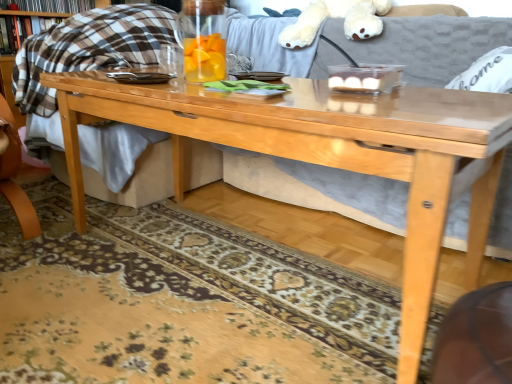
Measure the distance between point (193, 17) and camera.

The depth of point (193, 17) is 3.78 feet.

What is the approximate width of plaid fabric book at upper left, the second book from the top?

plaid fabric book at upper left, the second book from the top, is 14.29 centimeters in width.

Find the location of `white plush bear at upper center`. white plush bear at upper center is located at coordinates (336, 16).

This screenshot has width=512, height=384. I want to click on book that appears above the white plush bear at upper center (from a real-world perspective), so click(54, 5).

Is white plush bear at upper center aimed at hardcover book at upper left, which ranks as the 2th book in bottom-to-top order?

No, white plush bear at upper center is not turned towards hardcover book at upper left, which ranks as the 2th book in bottom-to-top order.

Consider the image. Does white plush bear at upper center lie behind hardcover book at upper left, marked as the first book in a top-to-bottom arrangement?

No, the depth of white plush bear at upper center is less than that of hardcover book at upper left, marked as the first book in a top-to-bottom arrangement.

Can you tell me how much white plush bear at upper center and hardcover book at upper left, which ranks as the 2th book in bottom-to-top order, differ in facing direction?

The facing directions of white plush bear at upper center and hardcover book at upper left, which ranks as the 2th book in bottom-to-top order, are 92.1 degrees apart.

Would you say white fabric pillow at upper right is part of white plush bear at upper center's contents?

No, white plush bear at upper center does not contain white fabric pillow at upper right.

Is white plush bear at upper center touching white fabric pillow at upper right?

white plush bear at upper center and white fabric pillow at upper right are clearly separated.

Is white plush bear at upper center facing away from white fabric pillow at upper right?

No, white plush bear at upper center's orientation is not away from white fabric pillow at upper right.

How different are the orientations of white plush bear at upper center and white fabric pillow at upper right in degrees?

white plush bear at upper center and white fabric pillow at upper right are facing 0.307 degrees away from each other.

Considering the sizes of objects plaid fabric book at upper left, the second book from the top, and transparent glass pitcher at center in the image provided, who is wider, plaid fabric book at upper left, the second book from the top, or transparent glass pitcher at center?

Wider between the two is transparent glass pitcher at center.

From the image's perspective, who appears lower, plaid fabric book at upper left, marked as the 1th book in a bottom-to-top arrangement, or transparent glass pitcher at center?

From the image's view, transparent glass pitcher at center is below.

Does plaid fabric book at upper left, marked as the 1th book in a bottom-to-top arrangement, have a larger size compared to transparent glass pitcher at center?

Correct, plaid fabric book at upper left, marked as the 1th book in a bottom-to-top arrangement, is larger in size than transparent glass pitcher at center.

Is hardcover book at upper left, which ranks as the 2th book in bottom-to-top order, not close to white plush bear at upper center?

Yes, hardcover book at upper left, which ranks as the 2th book in bottom-to-top order, and white plush bear at upper center are quite far apart.

Starting from the white plush bear at upper center, which book is the 1st one to the left? Please provide its 2D coordinates.

[(54, 5)]

Can you confirm if hardcover book at upper left, which ranks as the 2th book in bottom-to-top order, is thinner than white plush bear at upper center?

Correct, the width of hardcover book at upper left, which ranks as the 2th book in bottom-to-top order, is less than that of white plush bear at upper center.

Which object is closer to the camera, hardcover book at upper left, marked as the first book in a top-to-bottom arrangement, or white plush bear at upper center?

white plush bear at upper center.

Is white fabric pillow at upper right not within transparent glass pitcher at center?

That's correct, white fabric pillow at upper right is outside of transparent glass pitcher at center.

In the scene shown: Visually, is white fabric pillow at upper right positioned to the left or to the right of transparent glass pitcher at center?

Clearly, white fabric pillow at upper right is on the right of transparent glass pitcher at center in the image.

Considering the relative sizes of white fabric pillow at upper right and transparent glass pitcher at center in the image provided, is white fabric pillow at upper right thinner than transparent glass pitcher at center?

In fact, white fabric pillow at upper right might be wider than transparent glass pitcher at center.

Is white fabric pillow at upper right bigger or smaller than transparent glass pitcher at center?

In the image, white fabric pillow at upper right appears to be larger than transparent glass pitcher at center.

Is white fabric pillow at upper right placed right next to plaid fabric book at upper left, the second book from the top?

No, white fabric pillow at upper right is not with plaid fabric book at upper left, the second book from the top.

Is white fabric pillow at upper right closer to the viewer compared to plaid fabric book at upper left, the second book from the top?

Yes, white fabric pillow at upper right is closer to the viewer.

From the image's perspective, relative to plaid fabric book at upper left, marked as the 1th book in a bottom-to-top arrangement, is white fabric pillow at upper right above or below?

Based on their image positions, white fabric pillow at upper right is located beneath plaid fabric book at upper left, marked as the 1th book in a bottom-to-top arrangement.

Looking at this image, can you confirm if white fabric pillow at upper right is smaller than plaid fabric book at upper left, the second book from the top?

No.

Between point (460, 85) and point (298, 15), which one is positioned in front?

Positioned in front is point (460, 85).

Which object is positioned more to the right, white fabric pillow at upper right or white plush bear at upper center?

white fabric pillow at upper right.

Locate an element on the screen. The height and width of the screenshot is (384, 512). pillow on the right of white plush bear at upper center is located at coordinates [487, 73].

Locate an element on the screen. This screenshot has width=512, height=384. animal below the hardcover book at upper left, marked as the first book in a top-to-bottom arrangement (from the image's perspective) is located at coordinates (336, 16).

The image size is (512, 384). In the image, there is a white fabric pillow at upper right. What are the coordinates of `animal above it (from the image's perspective)` in the screenshot? It's located at (336, 16).

Estimate the real-world distances between objects in this image. Which object is further from transparent glass pitcher at center, plaid fabric book at upper left, the second book from the top, or white plush bear at upper center?

The object further to transparent glass pitcher at center is plaid fabric book at upper left, the second book from the top.

From the image, which object appears to be nearer to plaid fabric book at upper left, marked as the 1th book in a bottom-to-top arrangement, white fabric pillow at upper right or white plush bear at upper center?

white plush bear at upper center lies closer to plaid fabric book at upper left, marked as the 1th book in a bottom-to-top arrangement, than the other object.

Based on their spatial positions, is transparent glass pitcher at center or white plush bear at upper center closer to plaid fabric book at upper left, the second book from the top?

white plush bear at upper center lies closer to plaid fabric book at upper left, the second book from the top, than the other object.

From the image, which object appears to be farther from transparent glass pitcher at center, white plush bear at upper center or white fabric pillow at upper right?

white plush bear at upper center lies further to transparent glass pitcher at center than the other object.

Estimate the real-world distances between objects in this image. Which object is further from hardcover book at upper left, marked as the first book in a top-to-bottom arrangement, white plush bear at upper center or white fabric pillow at upper right?

Among the two, white fabric pillow at upper right is located further to hardcover book at upper left, marked as the first book in a top-to-bottom arrangement.

Based on their spatial positions, is white fabric pillow at upper right or hardcover book at upper left, marked as the first book in a top-to-bottom arrangement, further from transparent glass pitcher at center?

Based on the image, hardcover book at upper left, marked as the first book in a top-to-bottom arrangement, appears to be further to transparent glass pitcher at center.

From the picture: Looking at the image, which one is located closer to plaid fabric book at upper left, marked as the 1th book in a bottom-to-top arrangement, hardcover book at upper left, which ranks as the 2th book in bottom-to-top order, or white plush bear at upper center?

hardcover book at upper left, which ranks as the 2th book in bottom-to-top order, lies closer to plaid fabric book at upper left, marked as the 1th book in a bottom-to-top arrangement, than the other object.

Based on their spatial positions, is transparent glass pitcher at center or plaid fabric book at upper left, the second book from the top, closer to white plush bear at upper center?

transparent glass pitcher at center is positioned closer to the anchor white plush bear at upper center.

Find the location of a particular element. Image resolution: width=512 pixels, height=384 pixels. animal between transparent glass pitcher at center and white fabric pillow at upper right from left to right is located at coordinates (336, 16).

Find the location of a particular element. glass jar between plaid fabric book at upper left, marked as the 1th book in a bottom-to-top arrangement, and white fabric pillow at upper right is located at coordinates (203, 39).

Where is `book located between plaid fabric book at upper left, marked as the 1th book in a bottom-to-top arrangement, and white fabric pillow at upper right in the left-right direction`? This screenshot has width=512, height=384. book located between plaid fabric book at upper left, marked as the 1th book in a bottom-to-top arrangement, and white fabric pillow at upper right in the left-right direction is located at coordinates (54, 5).

The height and width of the screenshot is (384, 512). I want to click on glass jar located between plaid fabric book at upper left, marked as the 1th book in a bottom-to-top arrangement, and white plush bear at upper center in the left-right direction, so click(x=203, y=39).